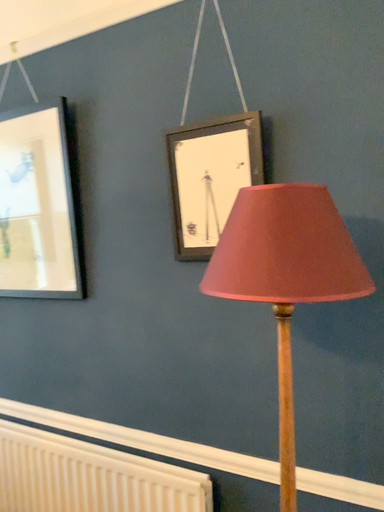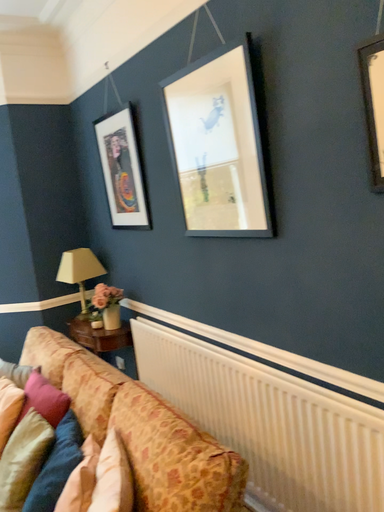
Question: Which way did the camera rotate in the video?

Choices:
 (A) rotated upward
 (B) rotated downward

Answer: (B)